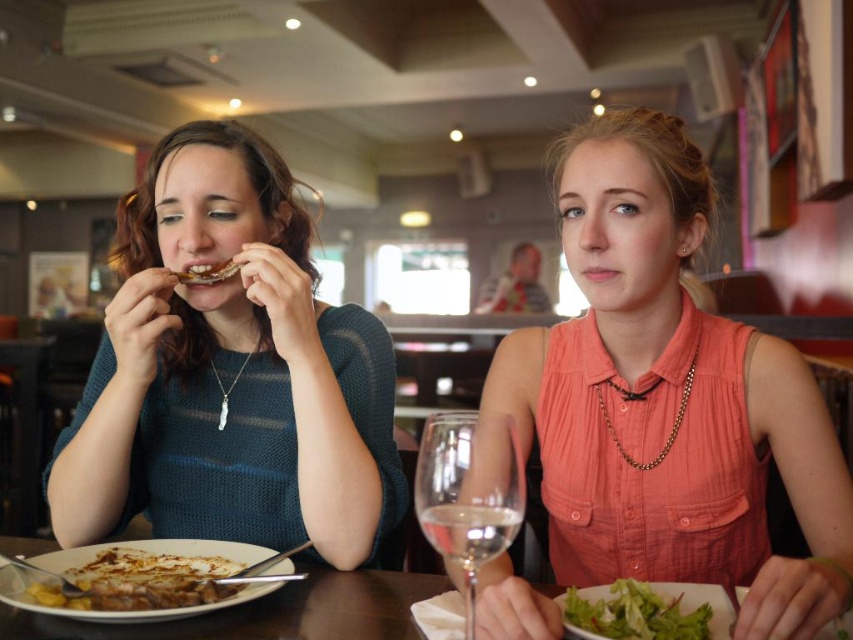
You are standing at the origin of the coordinate system in the image. Which of the two points, point [248,380] or point [120,547], is located further away from you?

Point [248,380] is behind point [120,547], so it is further away from you.

You are a food delivery person who needs to place an order for two people. The customer mentioned they want the larger portion. Based on the image, which item should you select between the green leafy salad at lower center and the brown crispy bread at center?

The green leafy salad at lower center is larger in size than the brown crispy bread at center, so you should select the green leafy salad at lower center as the larger portion.

You are a fashion designer observing the knitted teal sweater at left and the golden brown bread at lower left in the image. Which object is wider?

The knitted teal sweater at left is wider than the golden brown bread at lower left.